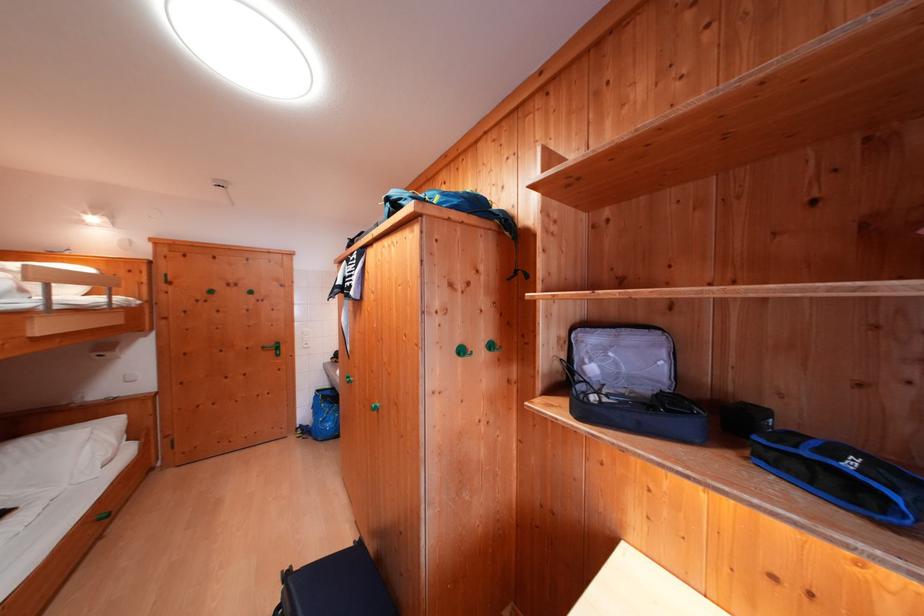
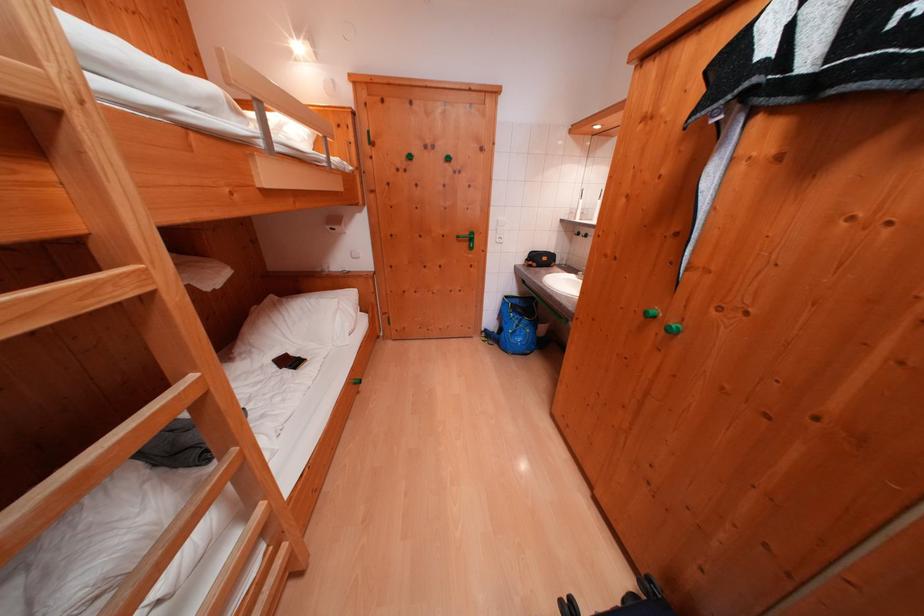
The point at (x=326, y=395) is marked in the first image. Where is the corresponding point in the second image?

(515, 301)